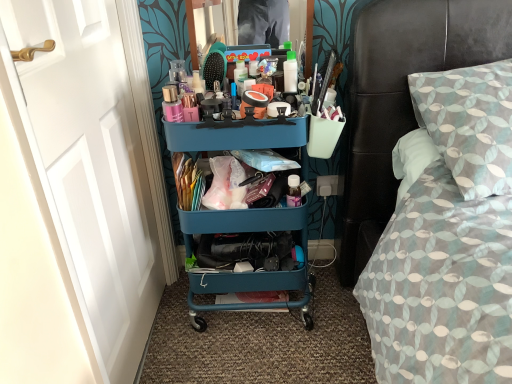
Find the location of a particular element. free space that is in between white painted wood door at left and teal plastic cart at center is located at coordinates (230, 357).